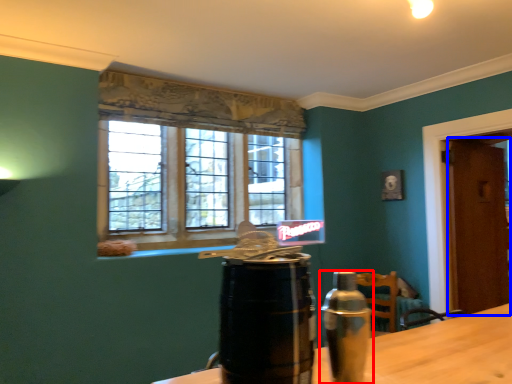
Question: Which point is closer to the camera, bottle (highlighted by a red box) or door (highlighted by a blue box)?

Choices:
 (A) bottle
 (B) door

Answer: (A)